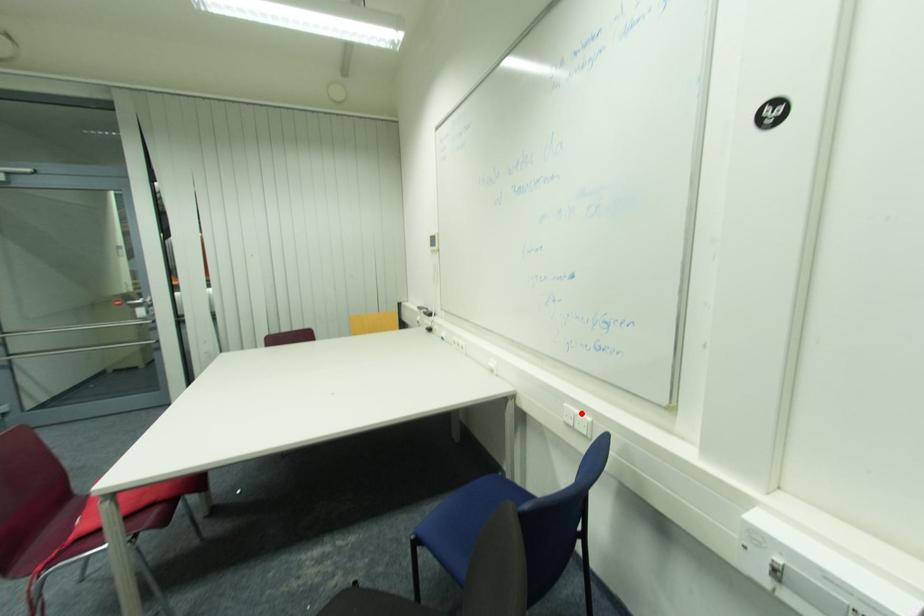
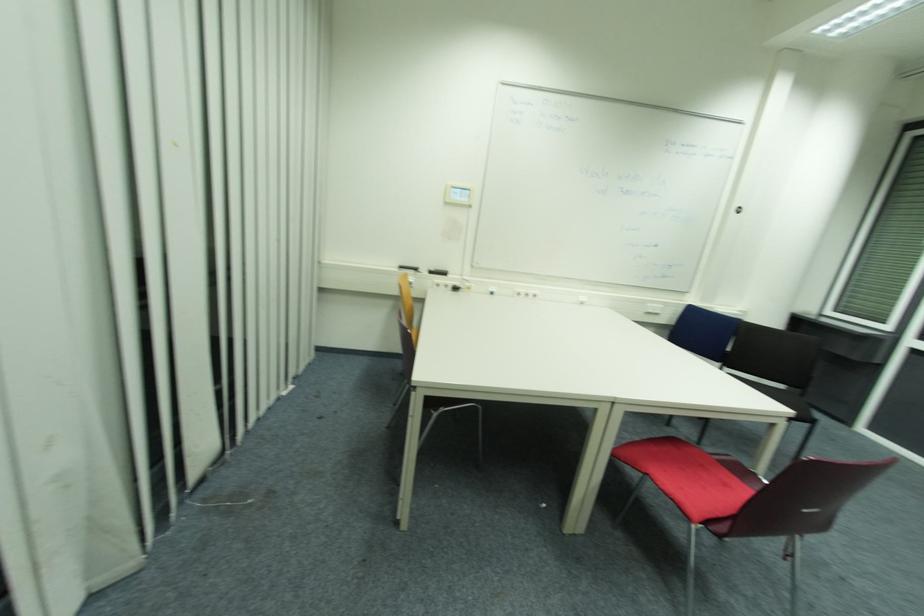
Question: A red point is marked in image1. In image2, is the corresponding 3D point closer to the camera or farther? Reply with the corresponding letter.

Choices:
 (A) The corresponding 3D point is closer.
 (B) The corresponding 3D point is farther.

Answer: (A)